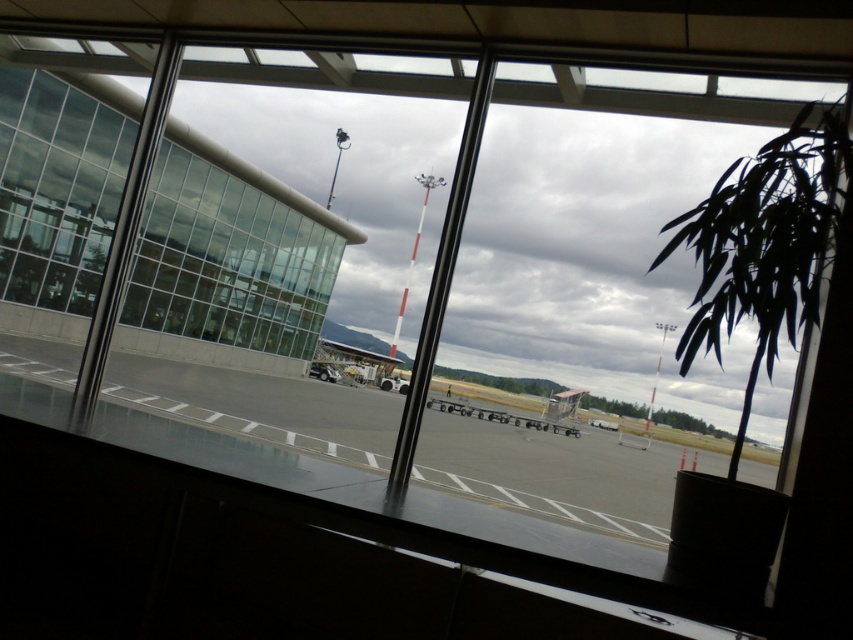
Does metallic gray airplane at center have a lesser height compared to metallic gray cart at center?

Indeed, metallic gray airplane at center has a lesser height compared to metallic gray cart at center.

Does metallic gray airplane at center have a larger size compared to metallic gray cart at center?

Incorrect, metallic gray airplane at center is not larger than metallic gray cart at center.

Is point (311, 369) positioned before point (469, 408)?

No, it is behind (469, 408).

Where is `metallic gray airplane at center`? This screenshot has height=640, width=853. metallic gray airplane at center is located at coordinates click(354, 365).

Which is more to the right, clear glass window at left or metallic gray airplane at center?

metallic gray airplane at center

Measure the distance between point (164, 310) and camera.

They are 22.94 meters apart.

What are the coordinates of `clear glass window at left` in the screenshot? It's located at (228, 262).

Who is taller, clear glass window at left or metallic gray cart at center?

clear glass window at left

Looking at this image, does clear glass window at left have a lesser width compared to metallic gray cart at center?

No.

Is point (239, 324) positioned behind point (556, 432)?

No, it is in front of (556, 432).

The width and height of the screenshot is (853, 640). Find the location of `clear glass window at left`. clear glass window at left is located at coordinates (228, 262).